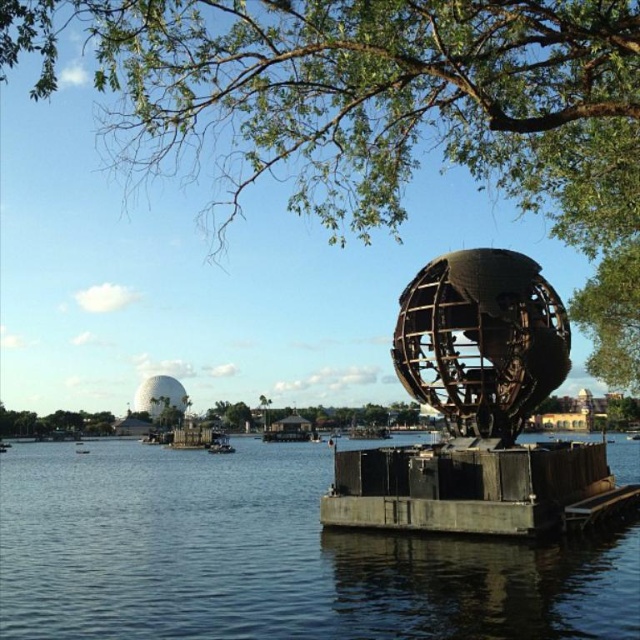
Question: Is dark blue water at center behind rustic wood dock at lower right?

Choices:
 (A) yes
 (B) no

Answer: (B)

Question: Can you confirm if green leafy tree at upper center is positioned below rustic wood dock at lower right?

Choices:
 (A) no
 (B) yes

Answer: (A)

Question: Estimate the real-world distances between objects in this image. Which object is farther from the green leafy tree at upper center?

Choices:
 (A) rustic wood dock at lower right
 (B) dark blue water at center

Answer: (A)

Question: Does dark blue water at center have a lesser width compared to rustic wood dock at lower right?

Choices:
 (A) yes
 (B) no

Answer: (B)

Question: Which of the following is the farthest from the observer?

Choices:
 (A) dark blue water at center
 (B) rustic wood dock at lower right

Answer: (B)

Question: Which object appears farthest from the camera in this image?

Choices:
 (A) rustic wood dock at lower right
 (B) dark blue water at center
 (C) green leafy tree at upper center

Answer: (A)